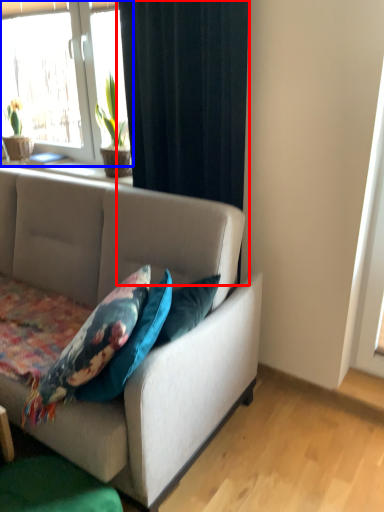
Question: Which of the following is the farthest to the observer, curtain (highlighted by a red box) or window (highlighted by a blue box)?

Choices:
 (A) curtain
 (B) window

Answer: (B)